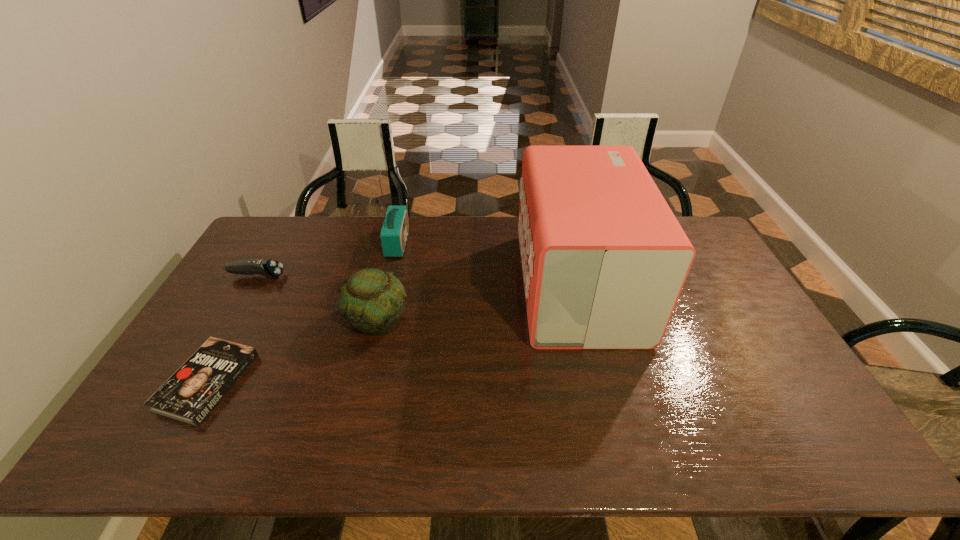
You are a GUI agent. You are given a task and a screenshot of the screen. Output one action in this format:
    pyautogui.click(x=<x>, y=<y>)
    Task: Click on the free spot between the electric shaver and the book
    The width and height of the screenshot is (960, 540).
    Given the screenshot: What is the action you would take?
    pyautogui.click(x=232, y=329)

At what (x,y) coordinates should I click in order to perform the action: click on unoccupied area between the electric shaver and the fourth shortest object. Please return your answer as a coordinate pair (x, y). The height and width of the screenshot is (540, 960). Looking at the image, I should click on (327, 259).

Identify the location of object that stands as the closest to the fourth tallest object. Image resolution: width=960 pixels, height=540 pixels. (372, 300).

Point out which object is positioned as the second nearest to the rightmost object. Please provide its 2D coordinates. Your answer should be formatted as a tuple, i.e. [(x, y)], where the tuple contains the x and y coordinates of a point satisfying the conditions above.

[(394, 232)]

What are the coordinates of `vacant space that satisfies the following two spatial constraints: 1. on the back side of the shortest object; 2. on the head of the fourth tallest object` in the screenshot? It's located at (266, 276).